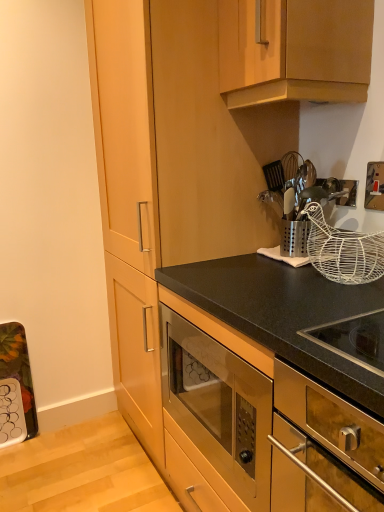
Question: Considering the relative sizes of gold metallic switch at upper right and wooden cabinet at upper center, the 2th cabinetry ordered from the bottom, in the image provided, is gold metallic switch at upper right taller than wooden cabinet at upper center, the 2th cabinetry ordered from the bottom,?

Choices:
 (A) yes
 (B) no

Answer: (B)

Question: Can you confirm if gold metallic switch at upper right is bigger than wooden cabinet at upper center, positioned as the 1th cabinetry in top-to-bottom order?

Choices:
 (A) no
 (B) yes

Answer: (A)

Question: Is gold metallic switch at upper right in contact with wooden cabinet at upper center, the 2th cabinetry ordered from the bottom?

Choices:
 (A) yes
 (B) no

Answer: (B)

Question: Is gold metallic switch at upper right not inside wooden cabinet at upper center, positioned as the 1th cabinetry in top-to-bottom order?

Choices:
 (A) yes
 (B) no

Answer: (A)

Question: Does gold metallic switch at upper right appear on the right side of wooden cabinet at upper center, the 2th cabinetry ordered from the bottom?

Choices:
 (A) yes
 (B) no

Answer: (A)

Question: From the image's perspective, relative to stainless steel oven at center, which is the 2th cabinetry in top-to-bottom order, is white wire basket at upper right above or below?

Choices:
 (A) above
 (B) below

Answer: (A)

Question: Is point (309, 208) positioned closer to the camera than point (334, 379)?

Choices:
 (A) farther
 (B) closer

Answer: (A)

Question: In terms of size, does white wire basket at upper right appear bigger or smaller than stainless steel oven at center, which is the 2th cabinetry in top-to-bottom order?

Choices:
 (A) big
 (B) small

Answer: (B)

Question: Based on their positions, is white wire basket at upper right located to the left or right of stainless steel oven at center, which is the 2th cabinetry in top-to-bottom order?

Choices:
 (A) left
 (B) right

Answer: (B)

Question: Is point (327, 419) positioned closer to the camera than point (283, 167)?

Choices:
 (A) closer
 (B) farther

Answer: (A)

Question: In terms of height, does stainless steel oven at lower right look taller or shorter compared to metallic silver utensil holder at upper right?

Choices:
 (A) short
 (B) tall

Answer: (B)

Question: From the image's perspective, relative to metallic silver utensil holder at upper right, is stainless steel oven at lower right above or below?

Choices:
 (A) below
 (B) above

Answer: (A)

Question: Is stainless steel oven at lower right inside the boundaries of metallic silver utensil holder at upper right, or outside?

Choices:
 (A) outside
 (B) inside

Answer: (A)

Question: From their relative heights in the image, would you say wooden cabinet at upper center, the 2th cabinetry ordered from the bottom, is taller or shorter than gold metallic switch at upper right?

Choices:
 (A) short
 (B) tall

Answer: (B)

Question: In terms of size, does wooden cabinet at upper center, the 2th cabinetry ordered from the bottom, appear bigger or smaller than gold metallic switch at upper right?

Choices:
 (A) small
 (B) big

Answer: (B)